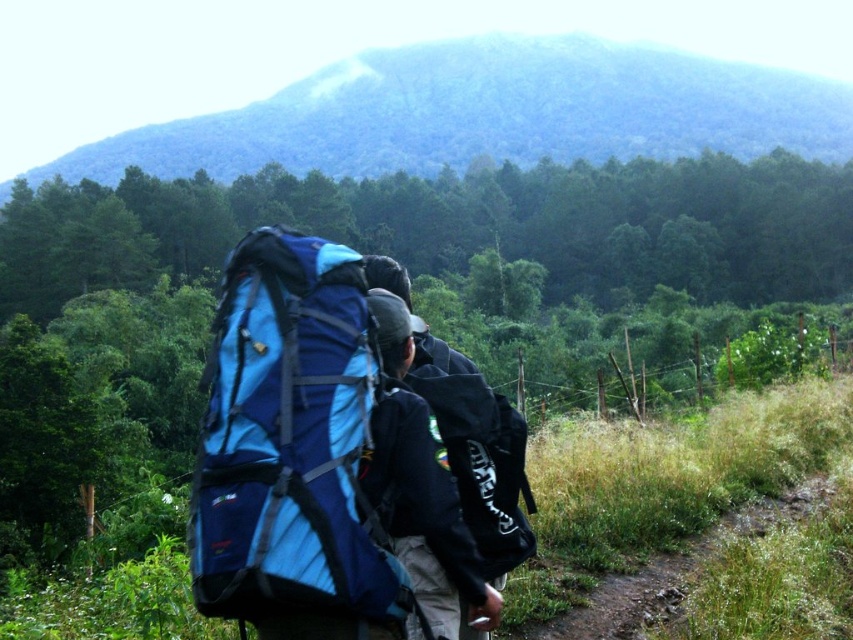
Can you confirm if green textured mountain at upper center is positioned to the left of black matte backpack at center?

In fact, green textured mountain at upper center is to the right of black matte backpack at center.

Which is more to the left, green textured mountain at upper center or black matte backpack at center?

black matte backpack at center is more to the left.

This screenshot has height=640, width=853. Describe the element at coordinates (490, 113) in the screenshot. I see `green textured mountain at upper center` at that location.

What are the coordinates of `green textured mountain at upper center` in the screenshot? It's located at (490, 113).

Can you confirm if blue fabric backpack at center is bigger than black matte backpack at center?

Correct, blue fabric backpack at center is larger in size than black matte backpack at center.

Looking at this image, is blue fabric backpack at center to the right of black matte backpack at center from the viewer's perspective?

Incorrect, blue fabric backpack at center is not on the right side of black matte backpack at center.

Is point (277, 433) farther from viewer compared to point (439, 396)?

No, (277, 433) is closer to viewer.

The width and height of the screenshot is (853, 640). Identify the location of blue fabric backpack at center. (289, 442).

Which is in front, point (335, 106) or point (405, 605)?

Point (405, 605) is more forward.

Can you confirm if green textured mountain at upper center is positioned below blue fabric backpack at center?

No.

Between point (766, 70) and point (299, 596), which one is positioned in front?

Point (299, 596) is more forward.

The width and height of the screenshot is (853, 640). I want to click on green textured mountain at upper center, so click(x=490, y=113).